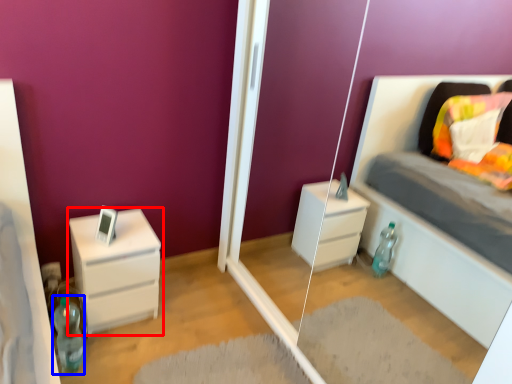
Question: Among these objects, which one is nearest to the camera, chest of drawers (highlighted by a red box) or bottle (highlighted by a blue box)?

Choices:
 (A) chest of drawers
 (B) bottle

Answer: (B)